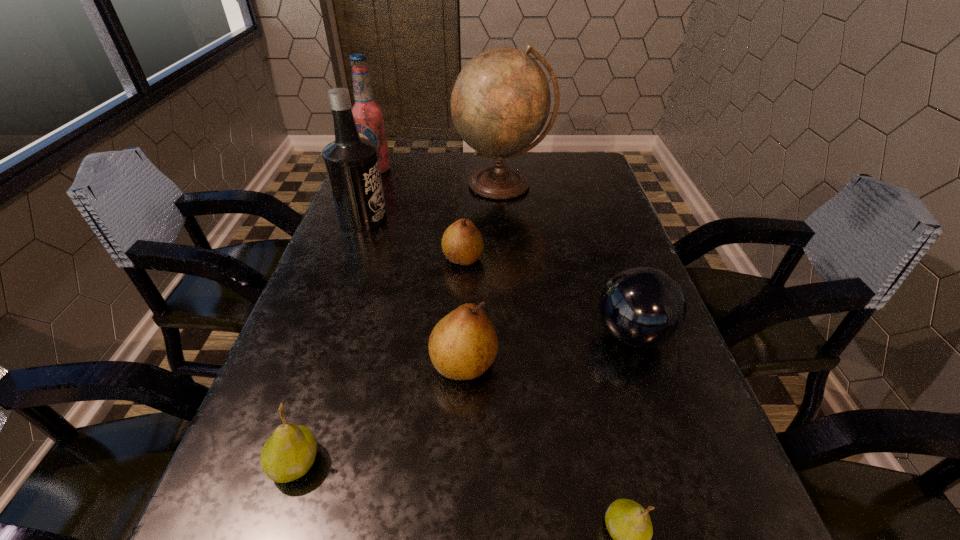
This screenshot has height=540, width=960. Identify the location of globe. (500, 102).

In order to click on liquor in this screenshot , I will do `click(352, 165)`.

Locate an element on the screen. blue alcohol is located at coordinates (369, 117).

Locate an element on the screen. Image resolution: width=960 pixels, height=540 pixels. the tallest pear is located at coordinates (463, 345).

The height and width of the screenshot is (540, 960). In order to click on the bigger brown pear in this screenshot , I will do `click(463, 345)`.

The image size is (960, 540). Identify the location of black bowling ball. 642,307.

At what (x,y) coordinates should I click in order to perform the action: click on the smaller brown pear. Please return your answer as a coordinate pair (x, y). The width and height of the screenshot is (960, 540). Looking at the image, I should click on (462, 243).

You are a GUI agent. You are given a task and a screenshot of the screen. Output one action in this format:
    pyautogui.click(x=<x>, y=<y>)
    Task: Click on the farther brown pear
    
    Given the screenshot: What is the action you would take?
    pyautogui.click(x=462, y=243)

Identify the location of the farther green pear. (289, 453).

What are the coordinates of `the left green pear` in the screenshot? It's located at (289, 453).